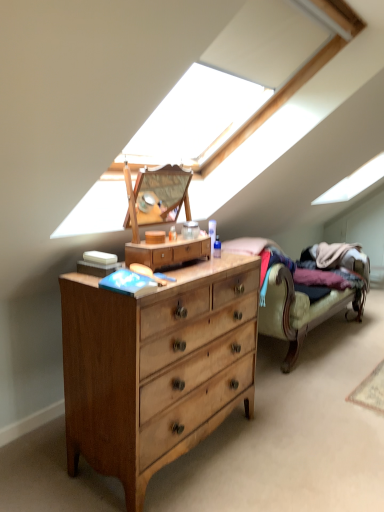
You are a GUI agent. You are given a task and a screenshot of the screen. Output one action in this format:
    pyautogui.click(x=<x>, y=<y>)
    Task: Click on the vacant area located to the right-hand side of light wood chest of drawers at center
    The width and height of the screenshot is (384, 512).
    Given the screenshot: What is the action you would take?
    pyautogui.click(x=308, y=446)